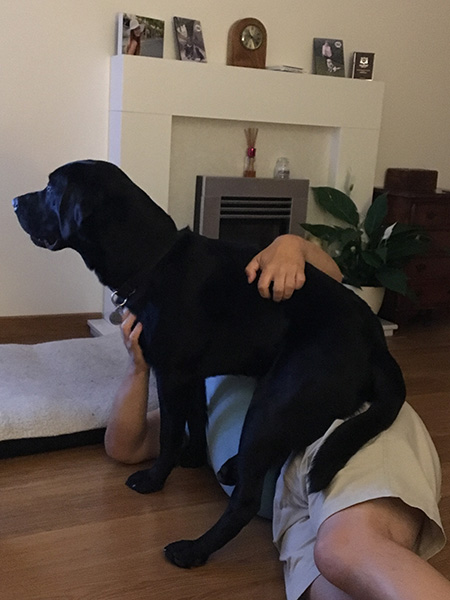
The image size is (450, 600). In order to click on plant in this screenshot , I will do `click(367, 246)`.